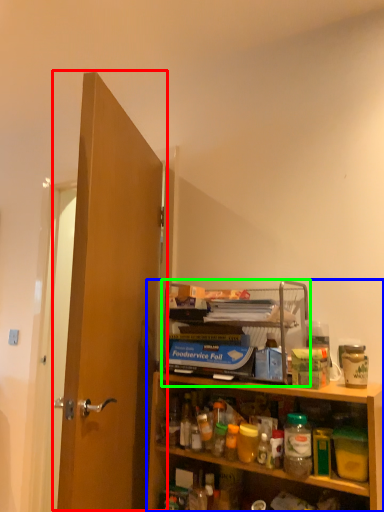
Question: Estimate the real-world distances between objects in this image. Which object is closer to door (highlighted by a red box), cabinetry (highlighted by a blue box) or shelf (highlighted by a green box)?

Choices:
 (A) cabinetry
 (B) shelf

Answer: (B)